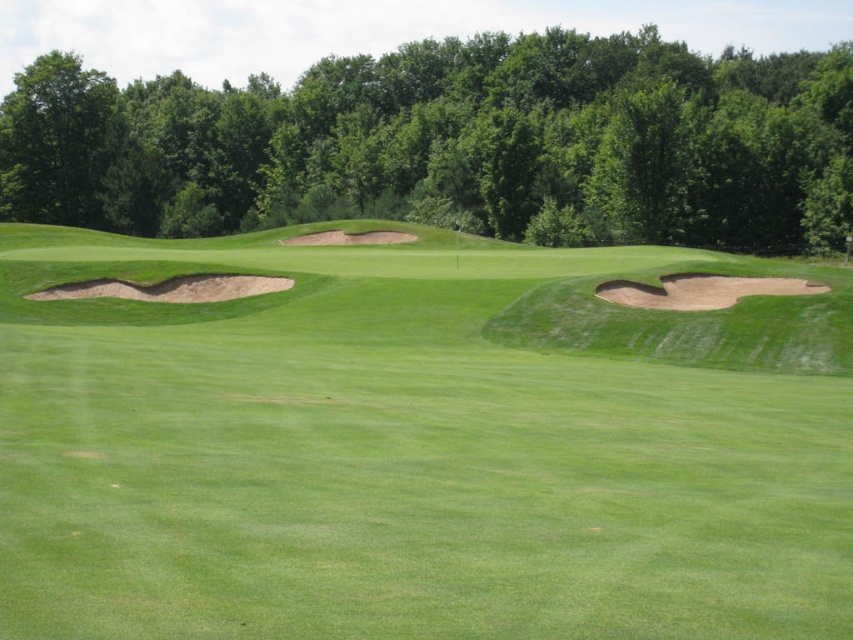
Who is higher up, green grassy fairway at center or sandy brown sand trap at left?

green grassy fairway at center is above.

Looking at this image, is green grassy fairway at center to the right of sandy brown sand trap at left from the viewer's perspective?

Correct, you'll find green grassy fairway at center to the right of sandy brown sand trap at left.

This screenshot has height=640, width=853. Identify the location of green grassy fairway at center. (418, 445).

Is green leafy trees at upper center further to camera compared to sandy brown sand trap at left?

Yes, it is.

Does point (216, 136) lie behind point (231, 288)?

Yes, point (216, 136) is behind point (231, 288).

You are a GUI agent. You are given a task and a screenshot of the screen. Output one action in this format:
    pyautogui.click(x=<x>, y=<y>)
    Task: Click on the green leafy trees at upper center
    The image size is (853, 640).
    Given the screenshot: What is the action you would take?
    pyautogui.click(x=451, y=144)

Can you confirm if green grassy fairway at center is thinner than green leafy trees at upper center?

Yes.

Who is more distant from viewer, (x=622, y=486) or (x=846, y=115)?

Point (x=846, y=115)

Identify the location of green grassy fairway at center. This screenshot has width=853, height=640. (418, 445).